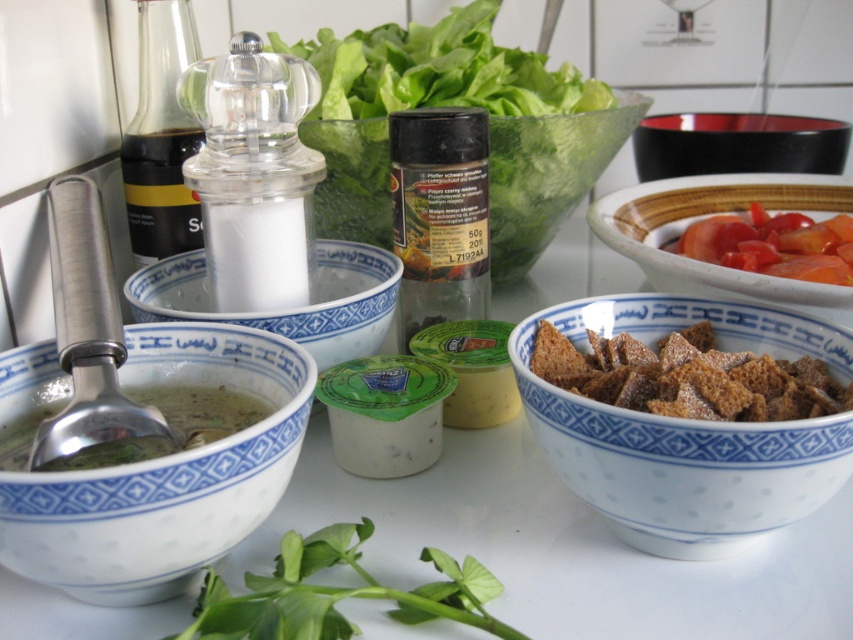
You are a chef preparing a dish and need to move a utensil from the black glossy bowl at upper right to the tomato salad at right. Given that the utensil is 3 inches long, will it reach without spilling?

Answer: The distance between the black glossy bowl at upper right and the tomato salad at right is 8.68 inches. Since the utensil is only 3 inches long, it will not be able to span the distance without spilling.

You are setting up a table for a dinner party and need to place a tall centerpiece. Which object between the black glossy bowl at upper right and the tomato salad at right would be more suitable for this purpose based on their heights?

The black glossy bowl at upper right is taller than the tomato salad at right, making it more suitable as a tall centerpiece.